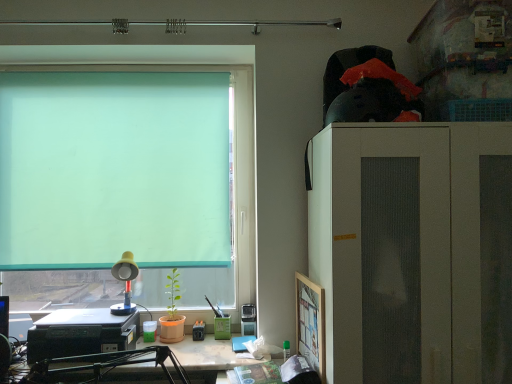
Find the location of `free spot above green translucent roller at upper left (from a real-world perspective)`. free spot above green translucent roller at upper left (from a real-world perspective) is located at coordinates (116, 70).